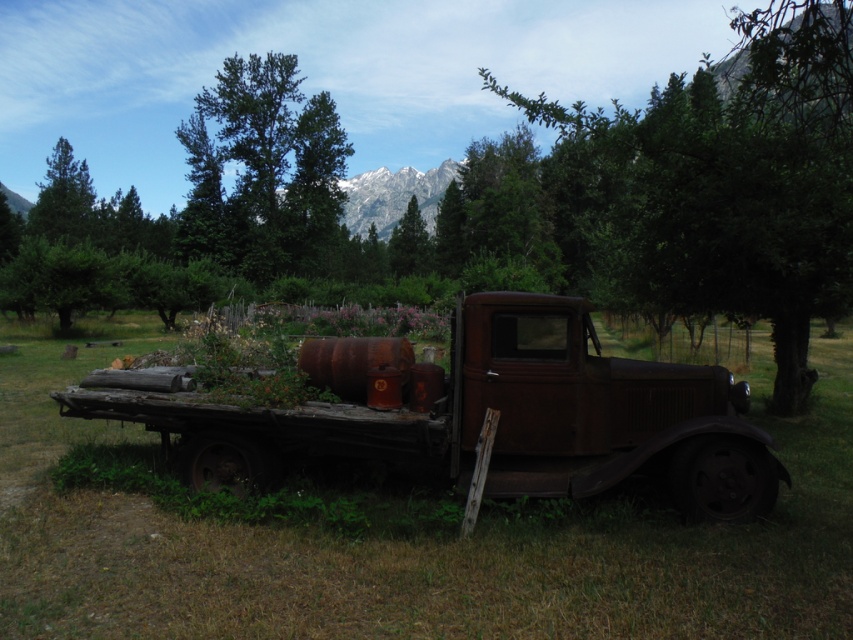
Can you confirm if green leafy tree at upper center is smaller than green matte tree at center?

Incorrect, green leafy tree at upper center is not smaller in size than green matte tree at center.

Who is more distant from viewer, (x=300, y=260) or (x=403, y=269)?

The point (x=403, y=269) is behind.

Identify the location of green leafy tree at upper center. (264, 170).

Between point (796, 81) and point (399, 236), which one is positioned behind?

Point (399, 236)

Between point (695, 186) and point (389, 240), which one is positioned in front?

Positioned in front is point (695, 186).

The height and width of the screenshot is (640, 853). Describe the element at coordinates (721, 182) in the screenshot. I see `green leafy tree at center` at that location.

Find the location of a particular element. The width and height of the screenshot is (853, 640). green leafy tree at center is located at coordinates (721, 182).

Is rusty metal truck at center smaller than green leafy tree at upper center?

Correct, rusty metal truck at center occupies less space than green leafy tree at upper center.

Which of these two, rusty metal truck at center or green leafy tree at upper center, stands shorter?

rusty metal truck at center

Does point (727, 413) lie in front of point (265, 244)?

Yes, point (727, 413) is closer to viewer.

Locate an element on the screen. This screenshot has height=640, width=853. rusty metal truck at center is located at coordinates (480, 413).